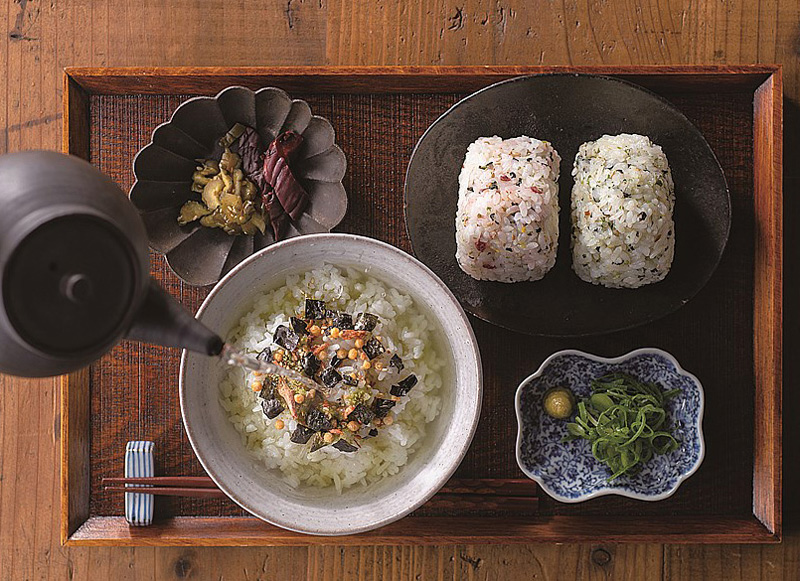
Locate an element on the screen. Image resolution: width=800 pixels, height=581 pixels. plates is located at coordinates [x=434, y=173], [x=534, y=419], [x=325, y=208], [x=480, y=394].